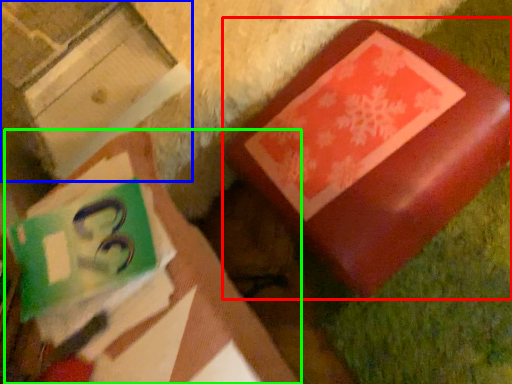
Question: Which object is positioned closest to furniture (highlighted by a red box)? Select from cardboard box (highlighted by a blue box) and book (highlighted by a green box).

Choices:
 (A) cardboard box
 (B) book

Answer: (B)